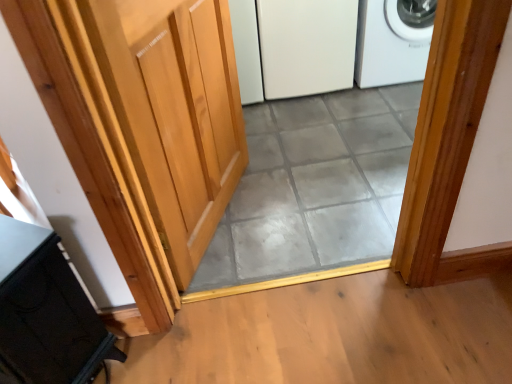
Question: Considering the positions of point (98, 359) and point (300, 145), is point (98, 359) closer or farther from the camera than point (300, 145)?

Choices:
 (A) closer
 (B) farther

Answer: (A)

Question: In terms of size, does black matte cabinet at lower left appear bigger or smaller than gray tile at center?

Choices:
 (A) big
 (B) small

Answer: (A)

Question: Based on their relative distances, which object is farther from the light wood door at center?

Choices:
 (A) white matte refrigerator at center
 (B) white plastic washing machine at upper right
 (C) black matte cabinet at lower left
 (D) gray tile at center

Answer: (B)

Question: Estimate the real-world distances between objects in this image. Which object is farther from the white plastic washing machine at upper right?

Choices:
 (A) gray tile at center
 (B) black matte cabinet at lower left
 (C) light wood door at center
 (D) white matte refrigerator at center

Answer: (B)